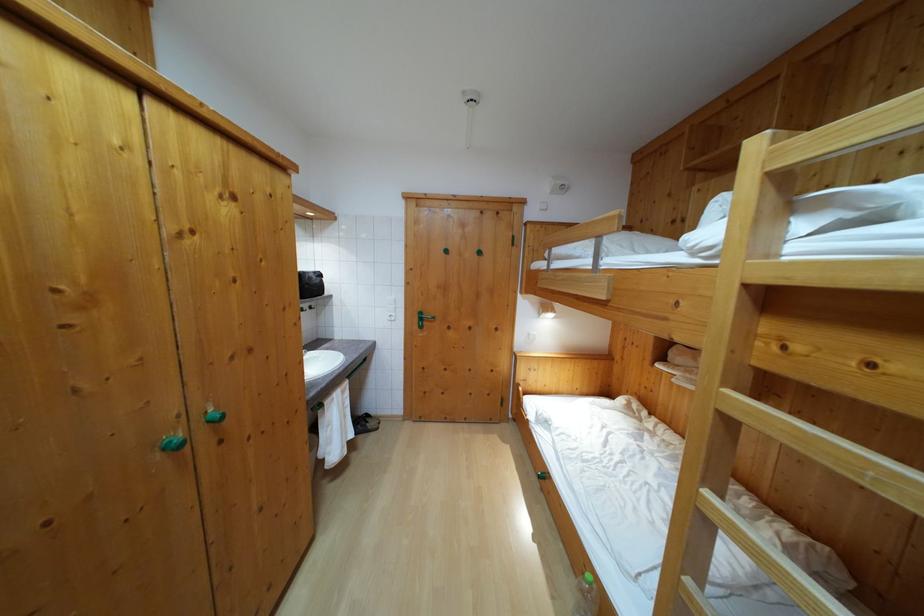
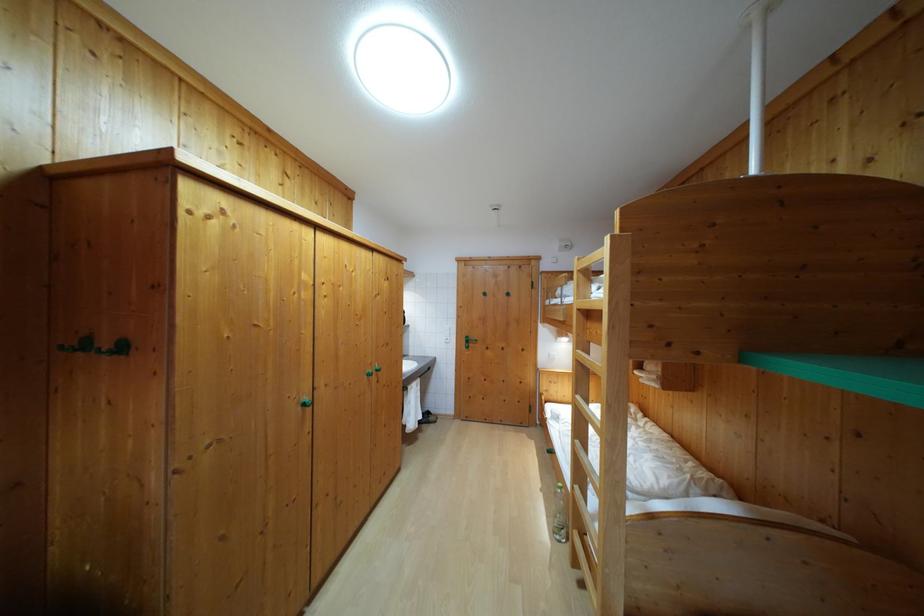
Question: The first image is from the beginning of the video and the second image is from the end. How did the camera likely rotate when shooting the video?

Choices:
 (A) Left
 (B) Right
 (C) Up
 (D) Down

Answer: (A)